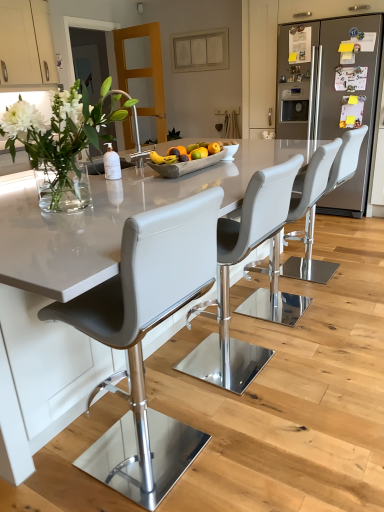
Question: Relative to white leather bar stool at center, acting as the fourth chair starting from the front, is white glossy table at center in front or behind?

Choices:
 (A) front
 (B) behind

Answer: (A)

Question: Is point click(x=172, y=185) closer or farther from the camera than point click(x=314, y=274)?

Choices:
 (A) farther
 (B) closer

Answer: (B)

Question: Which object is positioned farthest from the clear glass vase at left?

Choices:
 (A) white leather bar stool at center, placed as the first chair when sorted from back to front
 (B) satin silver refrigerator at right
 (C) matte gray chair at center, which ranks as the fourth chair in back-to-front order
 (D) gray leather bar stool at center, the third chair when ordered from front to back
 (E) matte white cabinet at upper left

Answer: (B)

Question: Based on their relative distances, which object is nearer to the satin silver refrigerator at right?

Choices:
 (A) white glossy table at center
 (B) matte white cabinet at upper left
 (C) gray leather bar stool at center, the third chair when ordered from front to back
 (D) matte gray chair at center, acting as the 1th chair starting from the front
 (E) yellow matte bananas at center

Answer: (A)